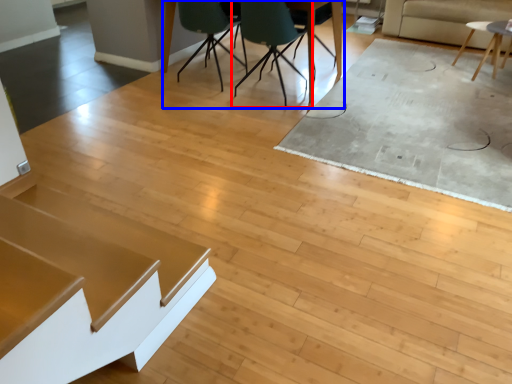
Question: Which object appears farthest to the camera in this image, chair (highlighted by a red box) or table (highlighted by a blue box)?

Choices:
 (A) chair
 (B) table

Answer: (B)